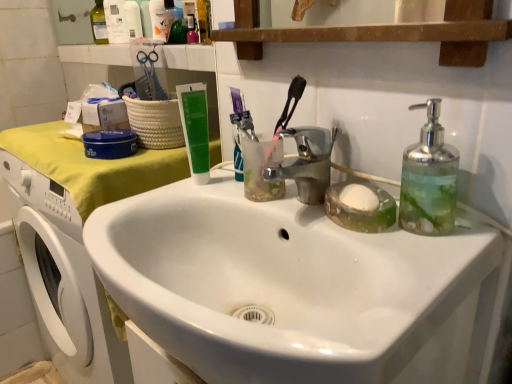
Question: Is clear glass soap dispenser at right facing away from green matte tube at upper center?

Choices:
 (A) no
 (B) yes

Answer: (A)

Question: Is clear glass soap dispenser at right smaller than green matte tube at upper center?

Choices:
 (A) no
 (B) yes

Answer: (A)

Question: Can green matte tube at upper center be found inside clear glass soap dispenser at right?

Choices:
 (A) yes
 (B) no

Answer: (B)

Question: Considering the relative positions of clear glass soap dispenser at right and green matte tube at upper center in the image provided, is clear glass soap dispenser at right to the left of green matte tube at upper center from the viewer's perspective?

Choices:
 (A) no
 (B) yes

Answer: (A)

Question: Is clear glass soap dispenser at right shorter than green matte tube at upper center?

Choices:
 (A) no
 (B) yes

Answer: (B)

Question: Relative to white glossy sink at center, is clear glass soap dispenser at right in front or behind?

Choices:
 (A) behind
 (B) front

Answer: (A)

Question: Is clear glass soap dispenser at right bigger or smaller than white glossy sink at center?

Choices:
 (A) big
 (B) small

Answer: (B)

Question: Based on their positions, is clear glass soap dispenser at right located to the left or right of white glossy sink at center?

Choices:
 (A) left
 (B) right

Answer: (B)

Question: Considering the positions of point (422, 173) and point (352, 372), is point (422, 173) closer or farther from the camera than point (352, 372)?

Choices:
 (A) closer
 (B) farther

Answer: (B)

Question: Based on their sizes in the image, would you say translucent plastic bottle at upper left, placed as the third toiletry when sorted from right to left, is bigger or smaller than green matte tube at upper center?

Choices:
 (A) big
 (B) small

Answer: (A)

Question: Based on their positions, is translucent plastic bottle at upper left, the 1th toiletry when ordered from left to right, located to the left or right of green matte tube at upper center?

Choices:
 (A) right
 (B) left

Answer: (B)

Question: Considering the positions of translucent plastic bottle at upper left, the 1th toiletry when ordered from left to right, and green matte tube at upper center in the image, is translucent plastic bottle at upper left, the 1th toiletry when ordered from left to right, wider or thinner than green matte tube at upper center?

Choices:
 (A) thin
 (B) wide

Answer: (B)

Question: From a real-world perspective, is translucent plastic bottle at upper left, which appears as the third toiletry when viewed from the front, positioned above or below green matte tube at upper center?

Choices:
 (A) above
 (B) below

Answer: (A)

Question: From the image's perspective, is green matte tube at upper center above or below white glossy sink at center?

Choices:
 (A) below
 (B) above

Answer: (B)

Question: Is green matte tube at upper center situated inside white glossy sink at center or outside?

Choices:
 (A) outside
 (B) inside

Answer: (A)